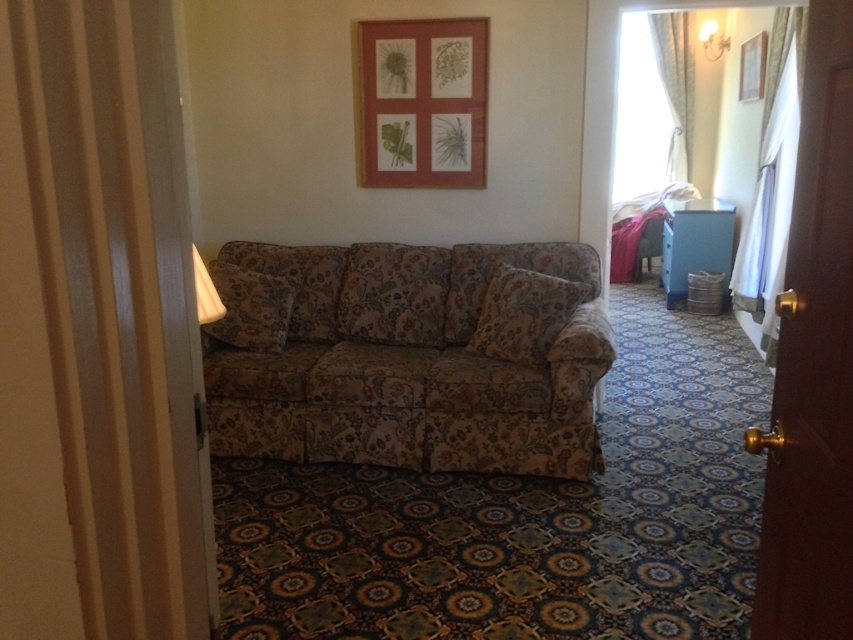
Question: Estimate the real-world distances between objects in this image. Which object is farther from the floral fabric couch at center?

Choices:
 (A) floral fabric armchair at center
 (B) wooden picture frame at upper center

Answer: (A)

Question: Can you confirm if floral fabric couch at center is thinner than wooden picture frame at upper center?

Choices:
 (A) yes
 (B) no

Answer: (B)

Question: Does wooden picture frame at upper center have a smaller size compared to floral fabric armchair at center?

Choices:
 (A) no
 (B) yes

Answer: (A)

Question: Among these objects, which one is nearest to the camera?

Choices:
 (A) wooden picture frame at upper center
 (B) floral fabric couch at center
 (C) floral fabric armchair at center

Answer: (B)

Question: Does floral fabric couch at center have a larger size compared to wooden picture frame at upper center?

Choices:
 (A) no
 (B) yes

Answer: (B)

Question: Which point appears farthest from the camera in this image?

Choices:
 (A) (636, 275)
 (B) (386, 28)
 (C) (216, 432)

Answer: (A)